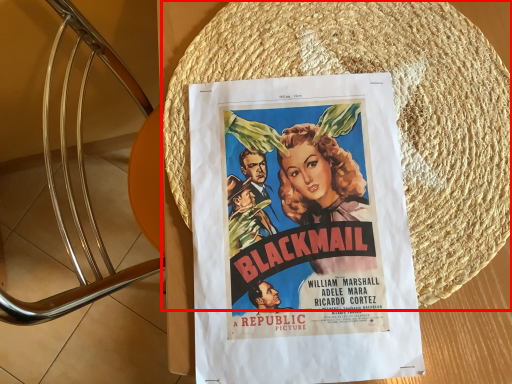
Question: Where is straw hat (annotated by the red box) located in relation to poster in the image?

Choices:
 (A) left
 (B) right

Answer: (B)